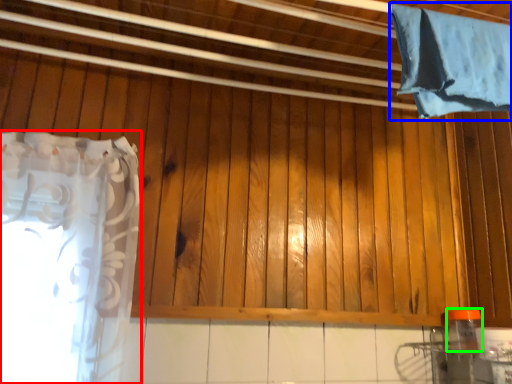
Question: Which object is positioned closest to curtain (highlighted by a red box)? Select from curtain (highlighted by a blue box) and bottle (highlighted by a green box).

Choices:
 (A) curtain
 (B) bottle

Answer: (A)